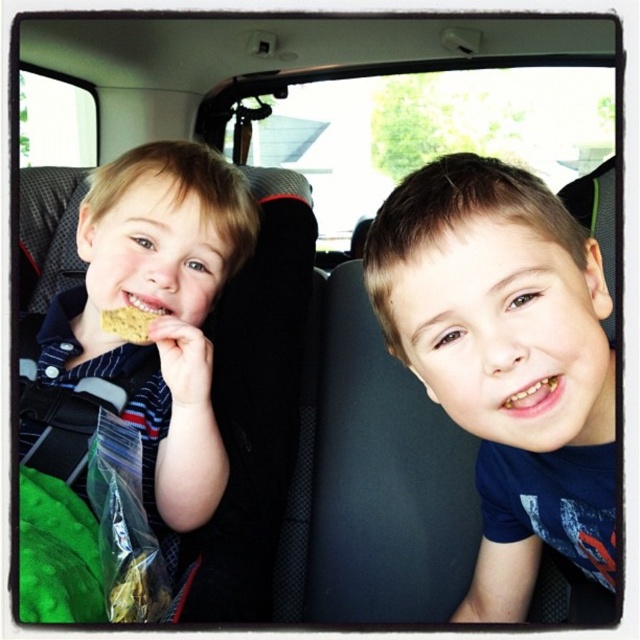
Question: In this image, where is blue matte shirt at center located relative to matte brown hair at left?

Choices:
 (A) left
 (B) right

Answer: (B)

Question: Does matte brown hair at left come behind golden cracker at mouth?

Choices:
 (A) yes
 (B) no

Answer: (B)

Question: Which of the following is the farthest from the observer?

Choices:
 (A) matte brown hair at left
 (B) blue matte shirt at center
 (C) golden cracker at mouth

Answer: (C)

Question: Which is farther from the golden cracker at mouth?

Choices:
 (A) matte brown hair at left
 (B) blue matte shirt at center

Answer: (B)

Question: Is blue matte shirt at center further to the viewer compared to golden cracker at mouth?

Choices:
 (A) no
 (B) yes

Answer: (A)

Question: Among these objects, which one is nearest to the camera?

Choices:
 (A) matte brown hair at left
 (B) blue matte shirt at center
 (C) golden cracker at mouth

Answer: (B)